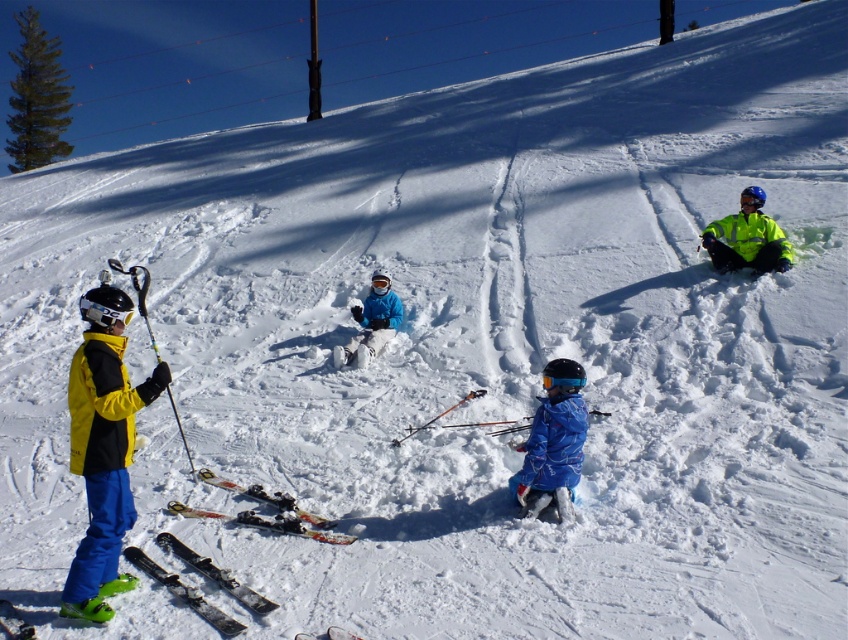
Between yellow matte jacket at left and white plastic skis at center, which one has more height?

yellow matte jacket at left

Measure the distance from yellow matte jacket at left to white plastic skis at center.

A distance of 4.77 feet exists between yellow matte jacket at left and white plastic skis at center.

Where is `yellow matte jacket at left`? yellow matte jacket at left is located at coordinates (103, 449).

Is blue matte snowsuit at center bigger than blue matte jacket at center?

No.

Is blue matte snowsuit at center positioned at the back of blue matte jacket at center?

No, blue matte snowsuit at center is closer to the viewer.

Who is more forward, (564, 481) or (372, 342)?

Point (564, 481) is in front.

In order to click on blue matte snowsuit at center in this screenshot , I will do `click(553, 444)`.

What do you see at coordinates (183, 593) in the screenshot? I see `black matte skis at lower left` at bounding box center [183, 593].

Does point (261, 596) lie in front of point (103, 312)?

No, it is not.

I want to click on black matte skis at lower left, so click(x=183, y=593).